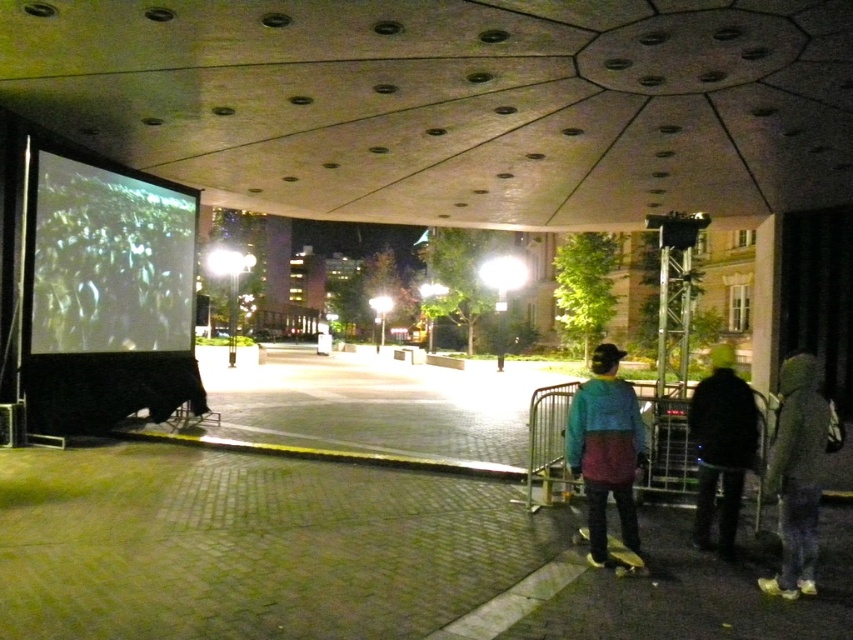
Question: Is dark gray hoodie at lower right further to camera compared to green rubber skateboard at lower right?

Choices:
 (A) yes
 (B) no

Answer: (A)

Question: Among these points, which one is nearest to the camera?

Choices:
 (A) (737, 392)
 (B) (772, 593)

Answer: (B)

Question: Which is farther from the white matte projection screen at left?

Choices:
 (A) dark gray hoodie at lower right
 (B) multicolored sweater at center
 (C) green fuzzy jacket at lower right
 (D) green rubber skateboard at lower right

Answer: (C)

Question: Which of the following is the closest to the observer?

Choices:
 (A) (743, 413)
 (B) (583, 538)
 (C) (45, 268)

Answer: (A)

Question: Can you confirm if green fuzzy jacket at lower right is thinner than green rubber skateboard at lower right?

Choices:
 (A) no
 (B) yes

Answer: (A)

Question: Observing the image, what is the correct spatial positioning of multicolored sweater at center in reference to green rubber skateboard at lower right?

Choices:
 (A) right
 (B) left

Answer: (A)